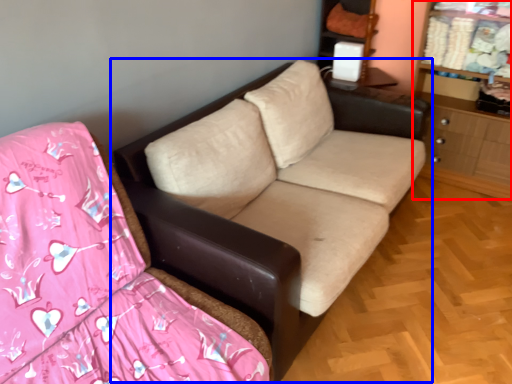
Question: Which object is further to the camera taking this photo, dresser (highlighted by a red box) or studio couch (highlighted by a blue box)?

Choices:
 (A) dresser
 (B) studio couch

Answer: (A)